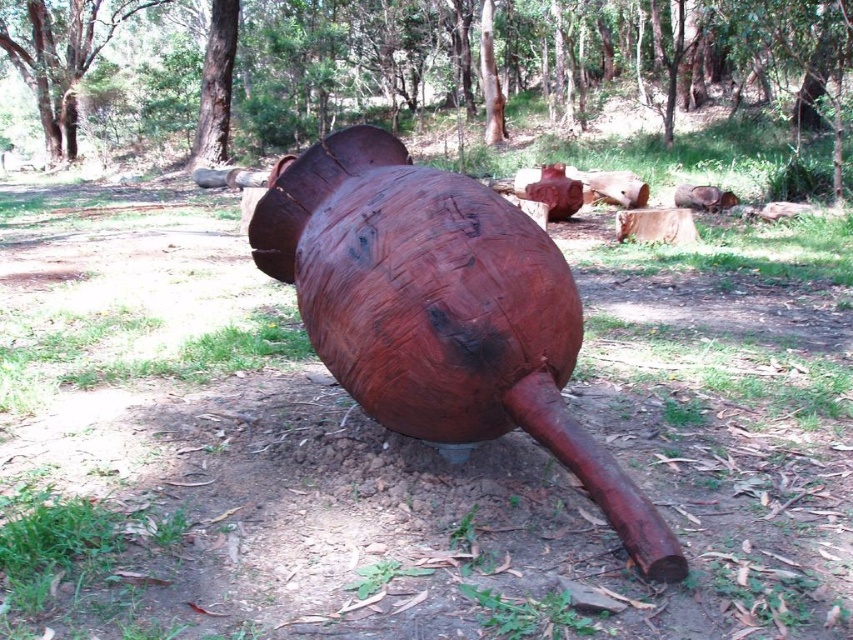
You are standing in the outdoor scene and want to take a photo of the rustic wood sculpture at center. To ensure the sculpture is centered in your photo, where should you position your camera relative to the sculpture?

The rustic wood sculpture at center is located at the coordinates point (x=440, y=310), so to center it in your photo, position your camera directly facing the sculpture at its central point.

You are standing in front of the sculpture and want to place a small plant pot between the smooth brown wooden log at center and the rustic wood sculpture at center. Which object should you place the pot closer to if you want it to appear closer to the viewer?

You should place the pot closer to the smooth brown wooden log at center because it is already further to the viewer than the rustic wood sculpture at center, making it appear closer.

A drone is flying at a height of 20 meters above the ground. It needs to capture a photo of the point at coordinates point[82,48] while avoiding the sculpture. The sculpture is 10 meters tall. Can the drone safely take the photo without hitting the sculpture?

The point at coordinates point[82,48] is 17.69 meters away from the sculpture, which is 10 meters tall. Since the drone is flying at 20 meters, it is high enough to safely capture the photo without hitting the sculpture.